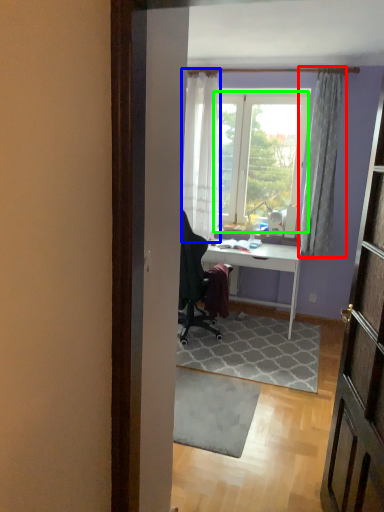
Question: Which is farther away from curtain (highlighted by a red box)? curtain (highlighted by a blue box) or window screen (highlighted by a green box)?

Choices:
 (A) curtain
 (B) window screen

Answer: (A)